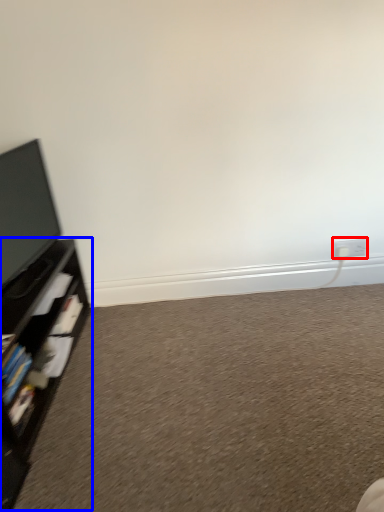
Question: Which of the following is the closest to the observer, electric outlet (highlighted by a red box) or shelf (highlighted by a blue box)?

Choices:
 (A) electric outlet
 (B) shelf

Answer: (B)